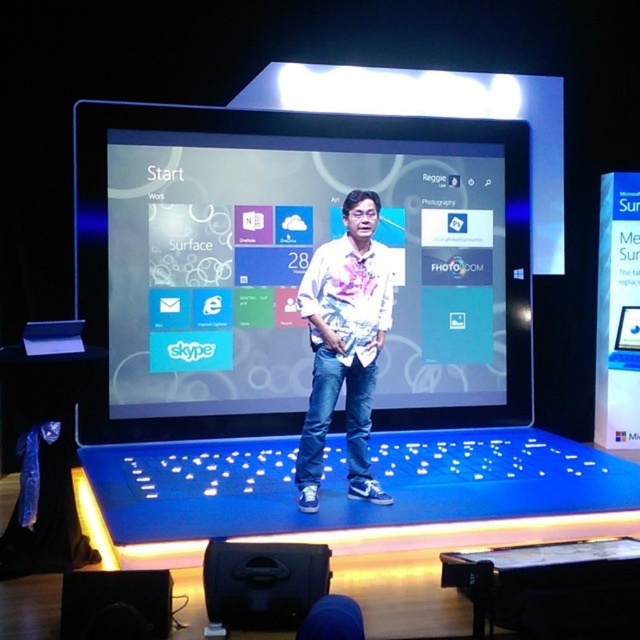
Question: Is matte plastic screen at center smaller than white printed shirt at center?

Choices:
 (A) yes
 (B) no

Answer: (B)

Question: Does matte plastic screen at center have a smaller size compared to white printed shirt at center?

Choices:
 (A) yes
 (B) no

Answer: (B)

Question: Which point appears farthest from the camera in this image?

Choices:
 (A) (493, 326)
 (B) (378, 276)

Answer: (A)

Question: Which point is closer to the camera?

Choices:
 (A) (355, 292)
 (B) (184, 170)

Answer: (A)

Question: Does matte plastic screen at center appear under white printed shirt at center?

Choices:
 (A) no
 (B) yes

Answer: (A)